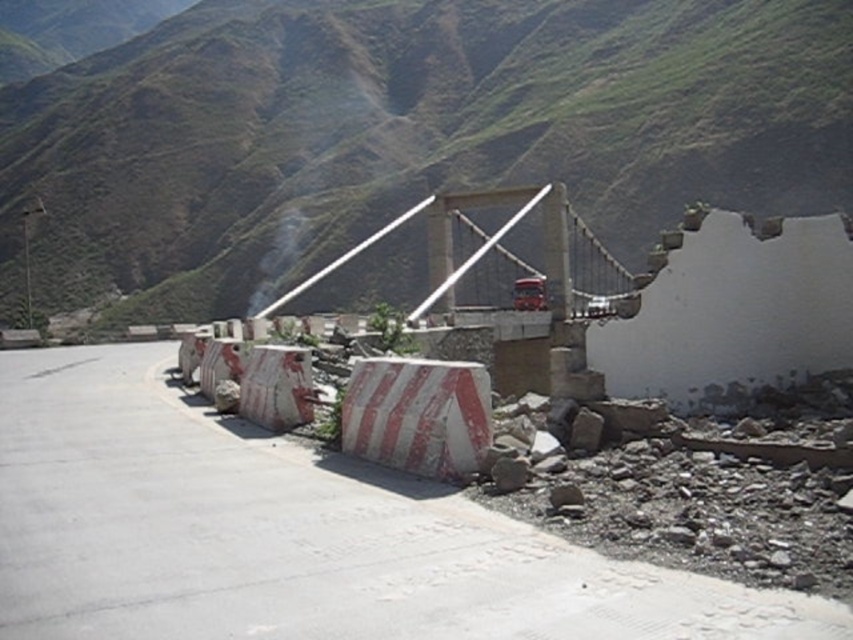
You are a hiker who has reached the edge of the road near the partially collapsed bridge. You see the green grassy mountain at upper center and the gray rough rock at lower right. Which object is higher in elevation?

The green grassy mountain at upper center is above the gray rough rock at lower right, so the green grassy mountain at upper center is higher in elevation.

You are a hiker trying to cross the damaged bridge. You notice the white concrete barrier at center and the gray rough rock at lower right. Which object would provide better protection from falling debris from the bridge?

The white concrete barrier at center is much taller than the gray rough rock at lower right, so it would provide better protection from falling debris from the bridge.

You are a hiker standing on the road and see the white concrete barrier at center and the gray rough rock at lower right. Which object is closer to the left edge of the road?

The white concrete barrier at center is positioned on the left side of gray rough rock at lower right, so it is closer to the left edge of the road.